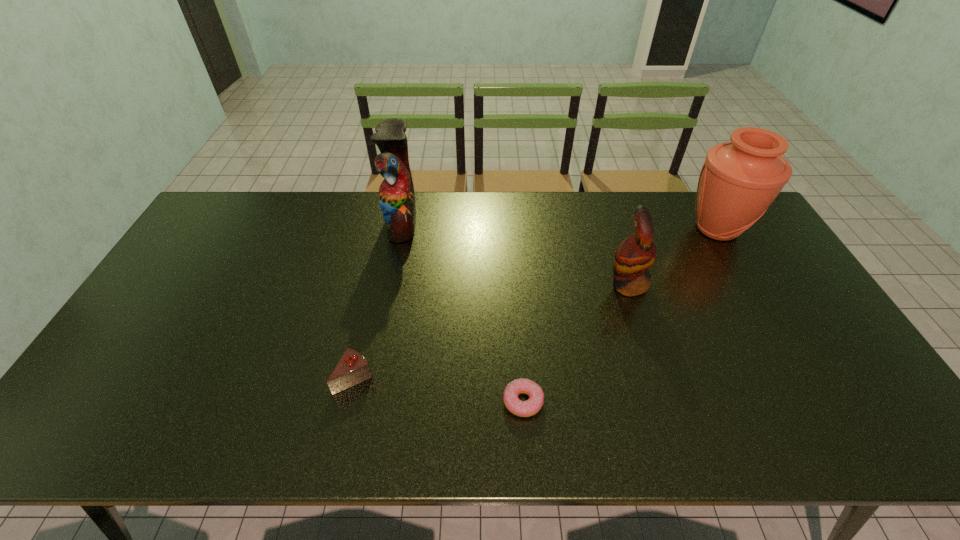
Locate an element on the screen. The image size is (960, 540). vacant area located 0.060m on the face of the second object from right to left is located at coordinates (587, 284).

This screenshot has width=960, height=540. I want to click on vacant area situated 0.170m on the face of the second object from right to left, so click(x=549, y=284).

Locate an element on the screen. The image size is (960, 540). vacant area situated 0.160m on the face of the second object from right to left is located at coordinates (553, 284).

Where is `free space located on the left of the fourth tallest object`? free space located on the left of the fourth tallest object is located at coordinates (204, 377).

You are a GUI agent. You are given a task and a screenshot of the screen. Output one action in this format:
    pyautogui.click(x=<x>, y=<y>)
    Task: Click on the free region located on the left of the third object from right to left
    The image size is (960, 540).
    Given the screenshot: What is the action you would take?
    pyautogui.click(x=465, y=401)

You are a GUI agent. You are given a task and a screenshot of the screen. Output one action in this format:
    pyautogui.click(x=<x>, y=<y>)
    Task: Click on the vase positioned at the far edge
    
    Given the screenshot: What is the action you would take?
    pyautogui.click(x=739, y=180)

This screenshot has height=540, width=960. Identify the location of parrot that is at the far edge. (396, 195).

Locate an element on the screen. object that is at the near edge is located at coordinates (530, 407).

Where is `object that is at the right edge`? object that is at the right edge is located at coordinates (739, 180).

This screenshot has width=960, height=540. I want to click on object that is at the far right corner, so click(739, 180).